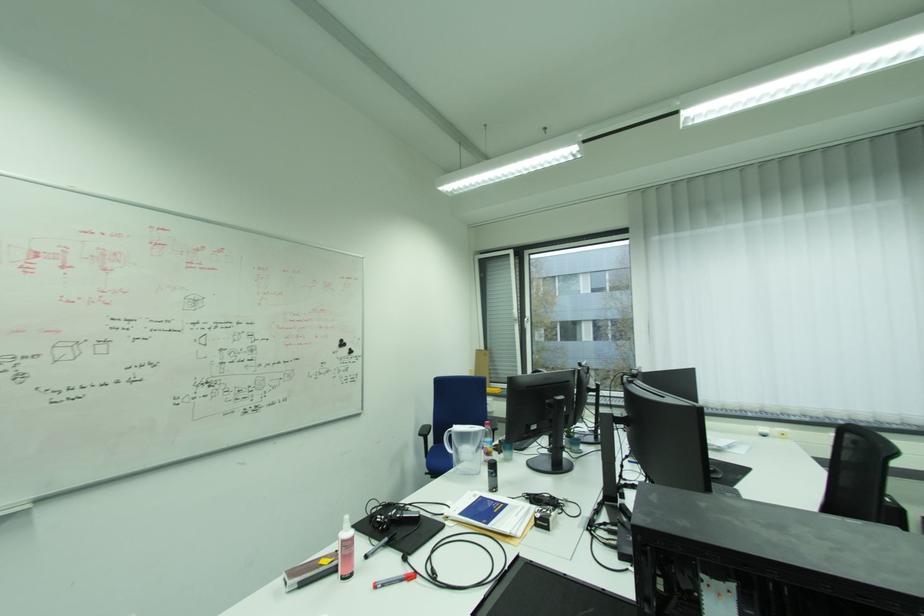
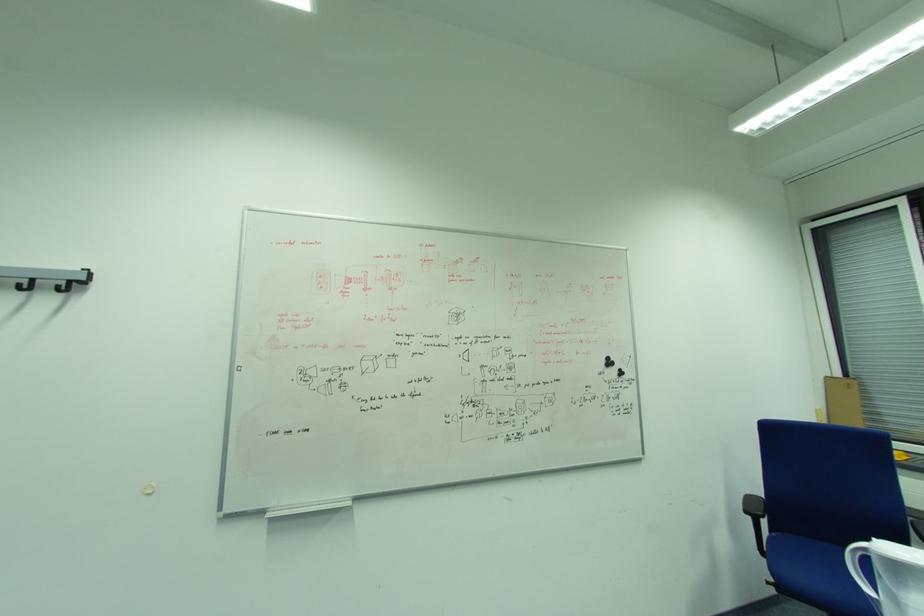
Where in the second image is the point corresponding to [435,471] from the first image?

(782, 582)